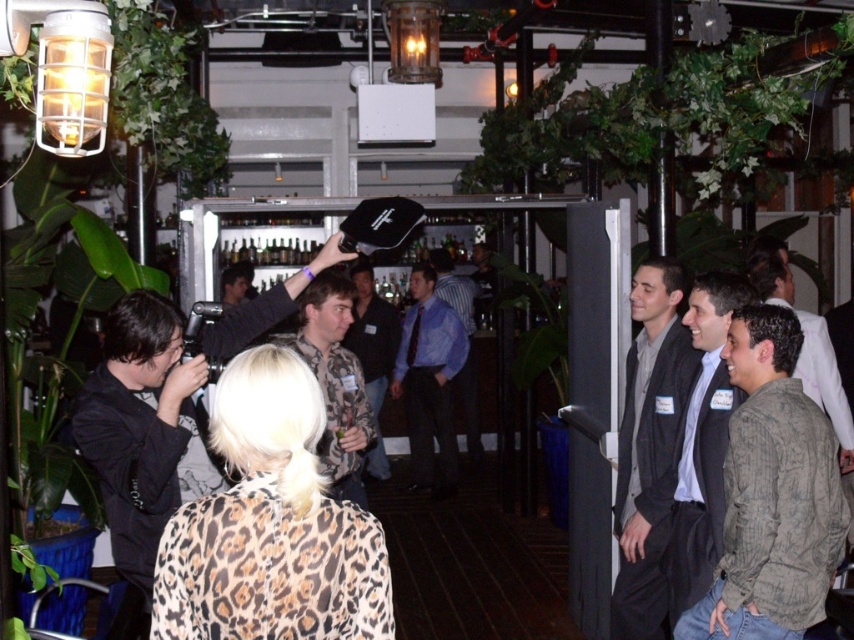
Is point (679, 360) more distant than point (332, 417)?

No, it is in front of (332, 417).

Looking at this image, who is positioned more to the left, dark gray suit at right or camouflage shirt at center?

camouflage shirt at center

The image size is (854, 640). In order to click on dark gray suit at right in this screenshot , I will do `click(648, 444)`.

This screenshot has width=854, height=640. Identify the location of dark gray suit at right. (648, 444).

Does dark gray suit at right appear on the right side of camouflage jacket at center?

Indeed, dark gray suit at right is positioned on the right side of camouflage jacket at center.

Is point (639, 384) positioned in front of point (385, 458)?

Yes, it is in front of point (385, 458).

You are a GUI agent. You are given a task and a screenshot of the screen. Output one action in this format:
    pyautogui.click(x=<x>, y=<y>)
    Task: Click on the dark gray suit at right
    
    Given the screenshot: What is the action you would take?
    click(x=648, y=444)

This screenshot has width=854, height=640. I want to click on dark gray suit at right, so click(x=648, y=444).

Can you confirm if green textured shirt at right is positioned above camouflage shirt at center?

Incorrect, green textured shirt at right is not positioned above camouflage shirt at center.

Which of these two, green textured shirt at right or camouflage shirt at center, stands taller?

With more height is camouflage shirt at center.

Which is behind, point (799, 474) or point (346, 458)?

The point (346, 458) is more distant.

At what (x,y) coordinates should I click in order to perform the action: click on green textured shirt at right. Please return your answer as a coordinate pair (x, y). The image size is (854, 640). Looking at the image, I should click on (x=771, y=493).